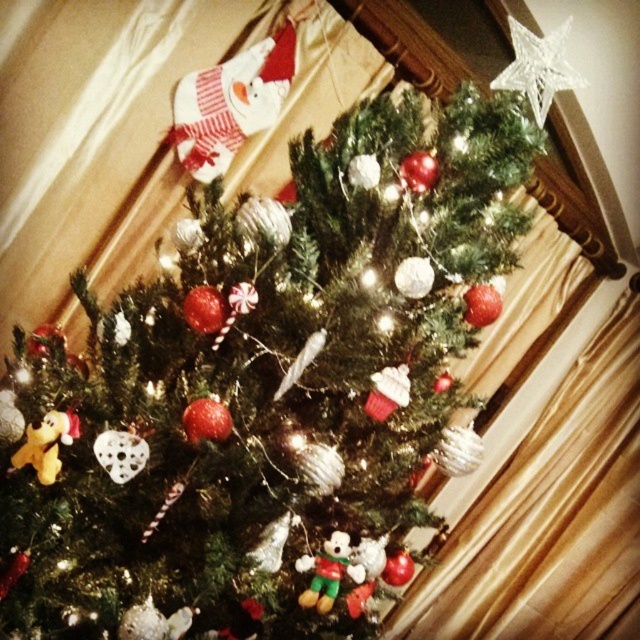
Question: Which point is closer to the camera?

Choices:
 (A) (58, 428)
 (B) (332, 552)

Answer: (A)

Question: Can you confirm if matte yellow plush bear at lower left is thinner than multicolored fabric plush at center?

Choices:
 (A) no
 (B) yes

Answer: (B)

Question: Which point is closer to the camera taking this photo?

Choices:
 (A) (36, 468)
 (B) (346, 532)

Answer: (A)

Question: Among these points, which one is farthest from the camera?

Choices:
 (A) (305, 570)
 (B) (51, 444)

Answer: (A)

Question: Is matte yellow plush bear at lower left bigger than multicolored fabric plush at center?

Choices:
 (A) no
 (B) yes

Answer: (A)

Question: Observing the image, what is the correct spatial positioning of matte yellow plush bear at lower left in reference to multicolored fabric plush at center?

Choices:
 (A) above
 (B) below

Answer: (A)